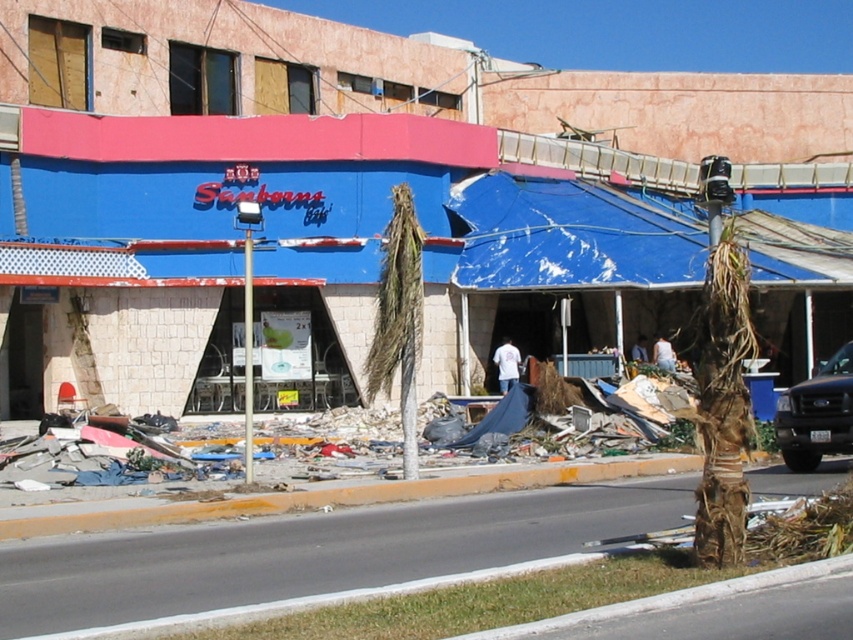
Between blue tarpaulin awning at center and black matte truck at right, which one has more height?

blue tarpaulin awning at center

Who is lower down, blue tarpaulin awning at center or black matte truck at right?

black matte truck at right is below.

Locate an element on the screen. blue tarpaulin awning at center is located at coordinates (300, 244).